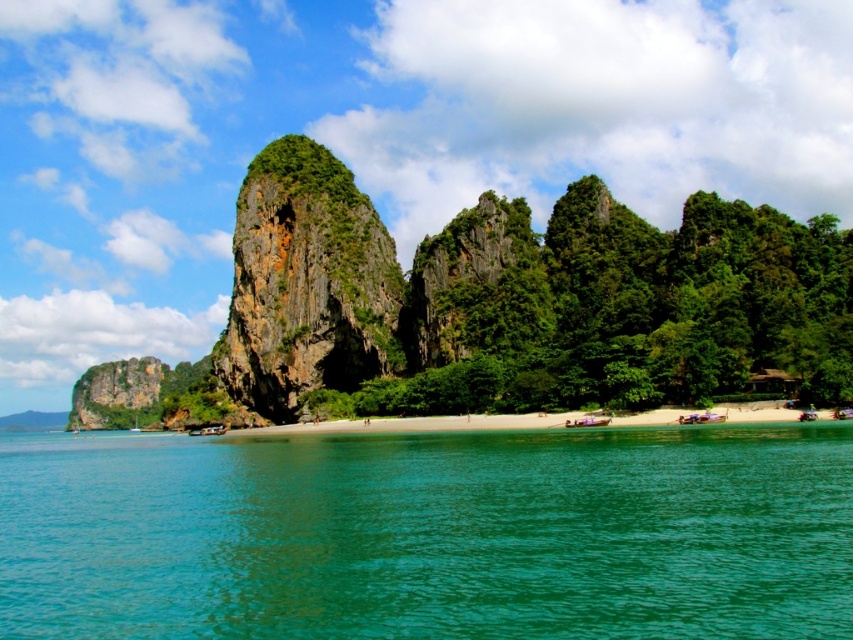
Question: Which of the following is the farthest from the observer?

Choices:
 (A) (656, 476)
 (B) (526, 234)
 (C) (532, 417)
 (D) (244, 276)

Answer: (D)

Question: Can you confirm if green mossy rock at center is thinner than white sand beach at center?

Choices:
 (A) no
 (B) yes

Answer: (B)

Question: From the image, what is the correct spatial relationship of green mossy rock at center in relation to white sand beach at center?

Choices:
 (A) left
 (B) right

Answer: (B)

Question: Can you confirm if green water at lower center is positioned to the left of green mossy rock at center?

Choices:
 (A) no
 (B) yes

Answer: (B)

Question: Estimate the real-world distances between objects in this image. Which object is closer to the green textured rock at center?

Choices:
 (A) green water at lower center
 (B) green mossy rock at center

Answer: (B)

Question: Considering the real-world distances, which object is closest to the green water at lower center?

Choices:
 (A) green textured rock at center
 (B) green mossy rock at center

Answer: (B)